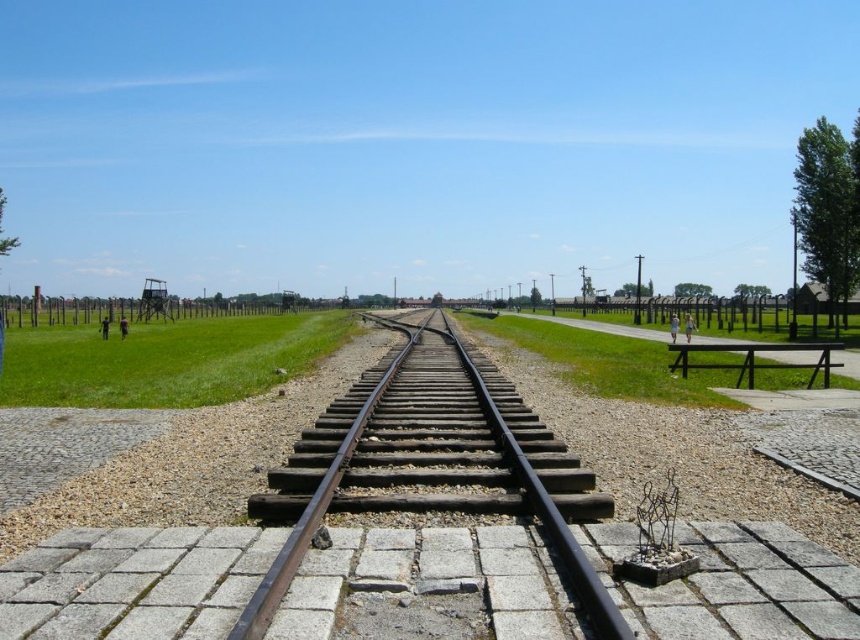
Does point (828, 608) come behind point (483, 476)?

No, (828, 608) is closer to viewer.

The image size is (860, 640). Identify the location of green grass at center. (422, 538).

This screenshot has width=860, height=640. Describe the element at coordinates (422, 538) in the screenshot. I see `green grass at center` at that location.

Locate an element on the screen. green grass at center is located at coordinates (422, 538).

Is green grass at center to the left of black wood park bench at lower right from the viewer's perspective?

Yes, green grass at center is to the left of black wood park bench at lower right.

Does point (432, 545) come closer to viewer compared to point (753, 356)?

That is True.

Between point (195, 612) and point (688, 364), which one is positioned behind?

The point (688, 364) is more distant.

Image resolution: width=860 pixels, height=640 pixels. What are the coordinates of `green grass at center` in the screenshot? It's located at (422, 538).

Who is positioned more to the right, black metal train track at center or black wood park bench at lower right?

black wood park bench at lower right is more to the right.

Does black metal train track at center come behind black wood park bench at lower right?

That is False.

What do you see at coordinates (432, 467) in the screenshot? I see `black metal train track at center` at bounding box center [432, 467].

Find the location of `black metal train track at center`. black metal train track at center is located at coordinates (432, 467).